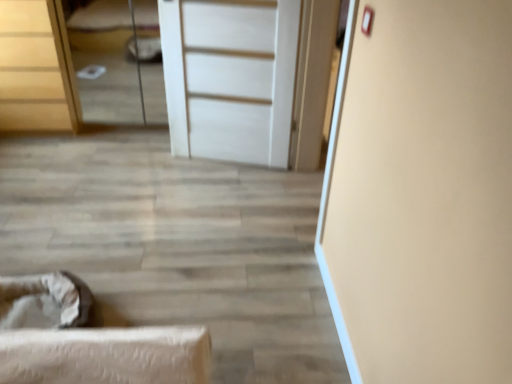
Question: Does point (165, 86) appear closer or farther from the camera than point (90, 18)?

Choices:
 (A) closer
 (B) farther

Answer: (A)

Question: In terms of width, does white matte door at center look wider or thinner when compared to matte white bed at upper left?

Choices:
 (A) wide
 (B) thin

Answer: (B)

Question: Which of these objects is positioned closest to the matte white bed at upper left?

Choices:
 (A) white matte door at center
 (B) wooden chest of drawers at upper left

Answer: (B)

Question: Which object is the closest to the wooden chest of drawers at upper left?

Choices:
 (A) white matte door at center
 (B) matte white bed at upper left

Answer: (B)